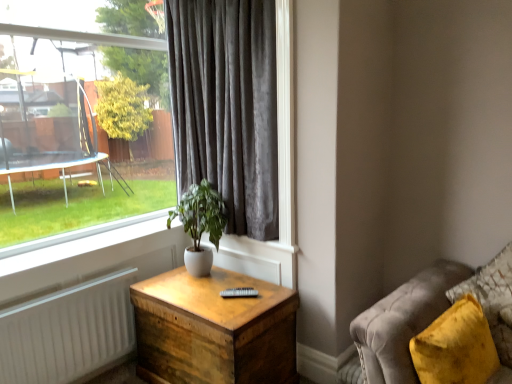
Where is `free space above white matte radiator at lower left (from a real-world perspective)`? The image size is (512, 384). free space above white matte radiator at lower left (from a real-world perspective) is located at coordinates (59, 294).